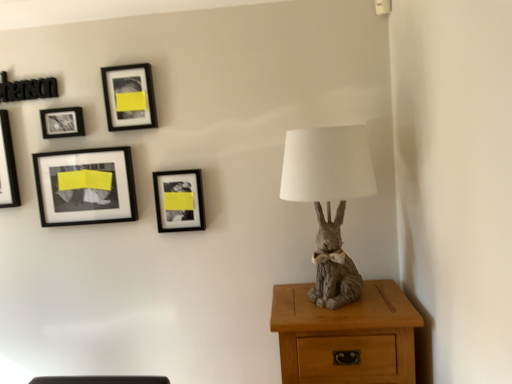
Question: Is light brown wood nightstand at lower right in front of or behind gray matte rabbit at right in the image?

Choices:
 (A) front
 (B) behind

Answer: (B)

Question: Looking at the image, does light brown wood nightstand at lower right seem bigger or smaller compared to gray matte rabbit at right?

Choices:
 (A) small
 (B) big

Answer: (B)

Question: Estimate the real-world distances between objects in this image. Which object is farther from the black matte picture frame at upper center, the 2th picture frame in the right-to-left sequence?

Choices:
 (A) gray matte rabbit at right
 (B) matte black frame at center, positioned as the fifth picture frame in left-to-right order
 (C) light brown wood nightstand at lower right
 (D) black glossy picture frame at upper left, which is counted as the first picture frame, starting from the left
 (E) matte black picture frame at upper left, placed as the 2th picture frame when sorted from left to right

Answer: (C)

Question: Which of these objects is positioned closest to the black matte picture frame at upper center, the fourth picture frame viewed from the left?

Choices:
 (A) gray matte rabbit at right
 (B) black matte picture frame at upper left, the third picture frame positioned from the left
 (C) black glossy picture frame at upper left, the fifth picture frame positioned from the right
 (D) light brown wood nightstand at lower right
 (E) matte black frame at center, the first picture frame viewed from the right

Answer: (B)